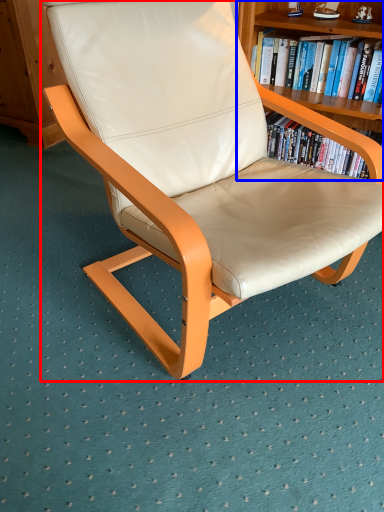
Question: Which point is closer to the camera, chair (highlighted by a red box) or bookcase (highlighted by a blue box)?

Choices:
 (A) chair
 (B) bookcase

Answer: (A)